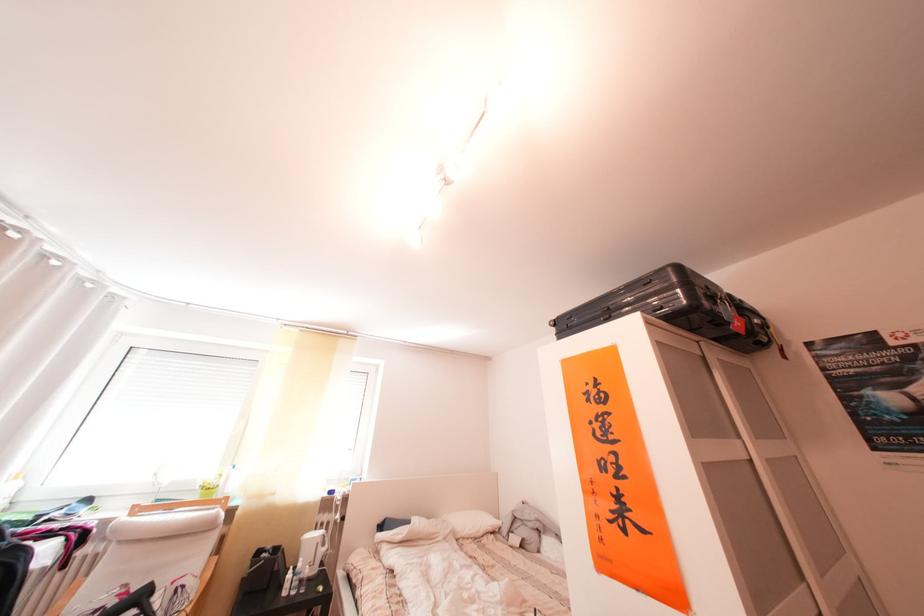
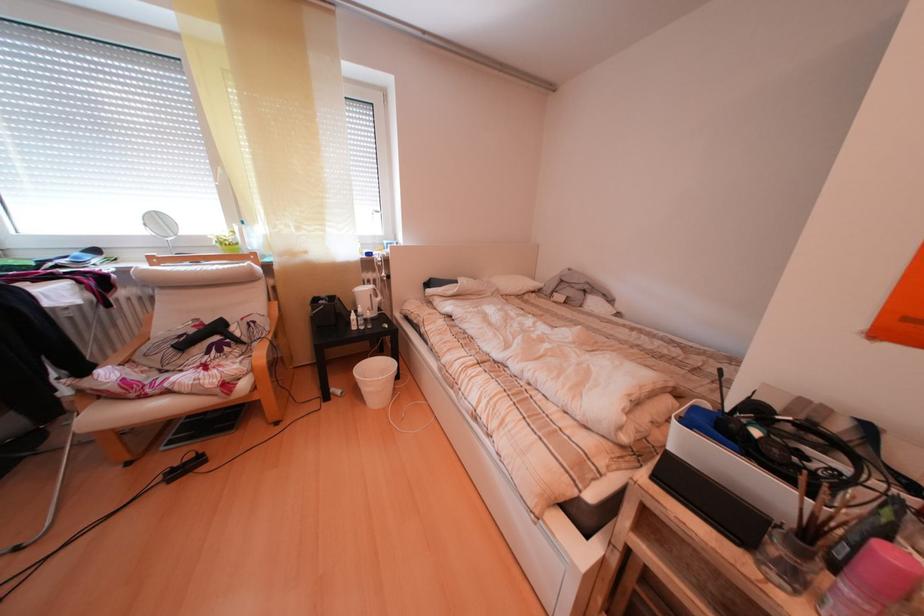
Question: The images are taken continuously from a first-person perspective. In which direction is your viewpoint rotating?

Choices:
 (A) Left
 (B) Right
 (C) Up
 (D) Down

Answer: (D)